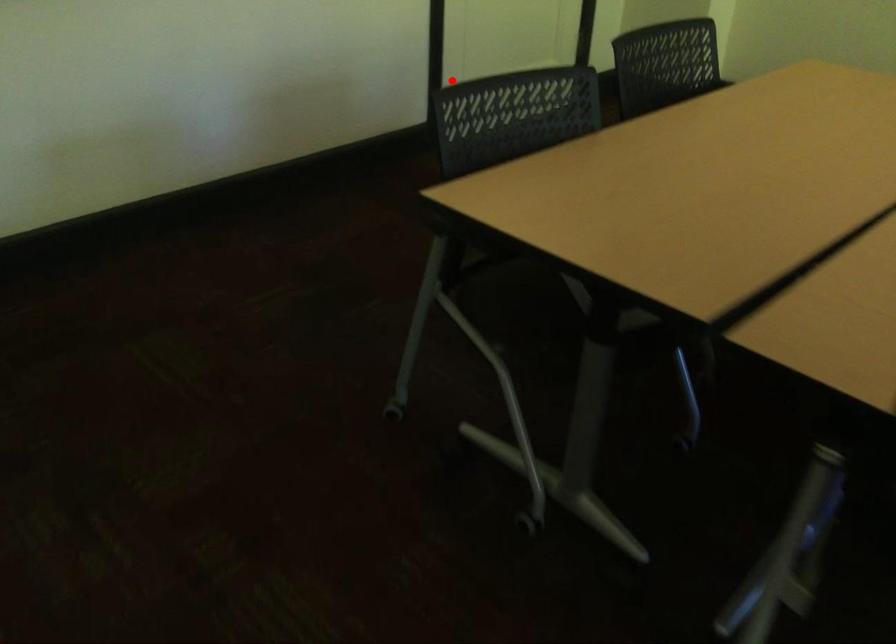
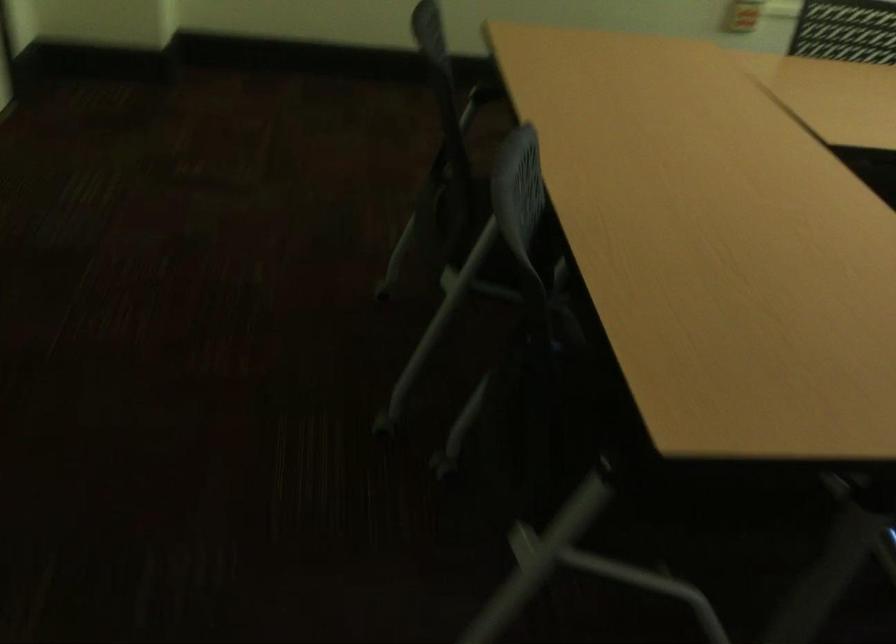
Question: I am providing you with two images of the same scene from different viewpoints. A red point is shown in image1. For the corresponding object point in image2, is it positioned nearer or farther from the camera?

Choices:
 (A) Nearer
 (B) Farther

Answer: (A)